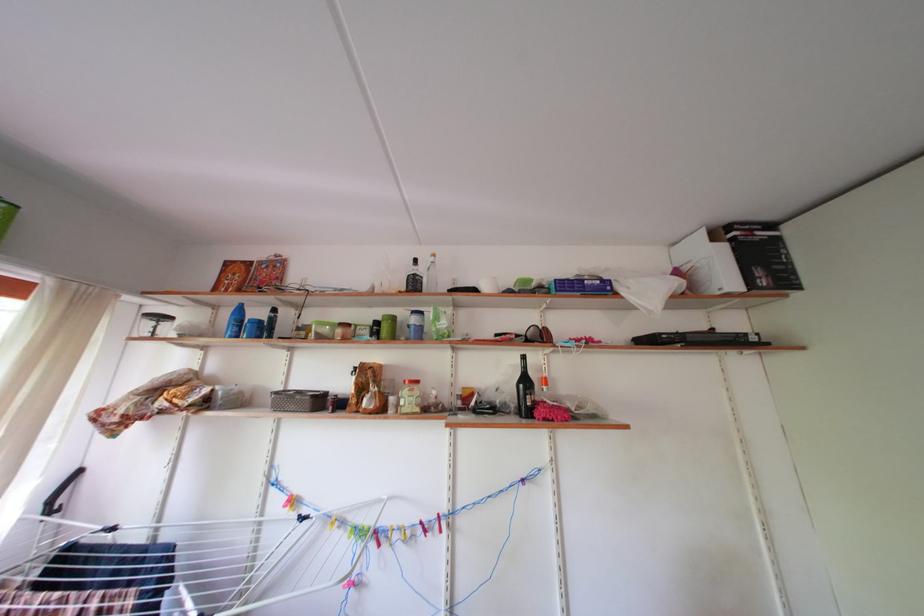
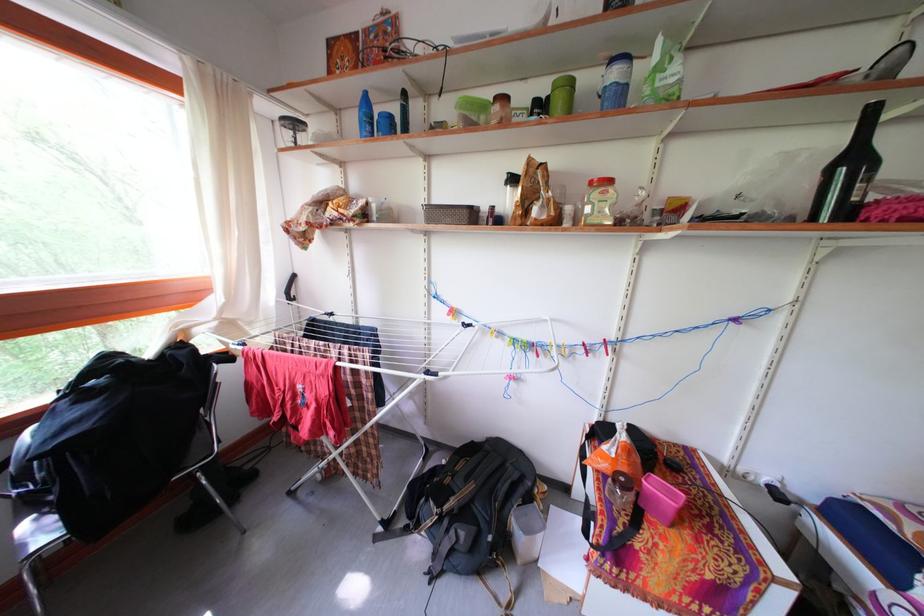
Locate, in the second image, the point that corresponds to the point at 419,406 in the first image.

(611, 211)